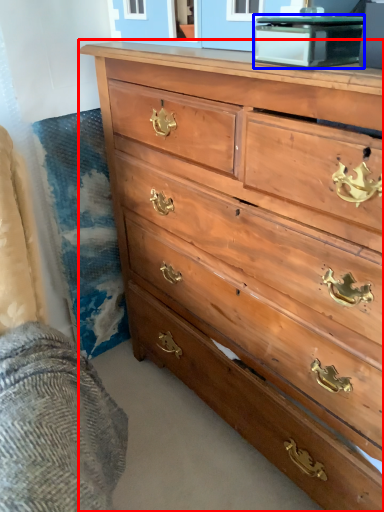
Question: Among these objects, which one is nearest to the camera, chest of drawers (highlighted by a red box) or cabinetry (highlighted by a blue box)?

Choices:
 (A) chest of drawers
 (B) cabinetry

Answer: (A)